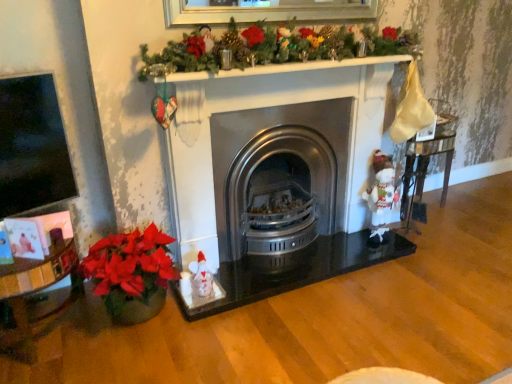
Question: Does point (244, 236) appear closer or farther from the camera than point (402, 178)?

Choices:
 (A) farther
 (B) closer

Answer: (B)

Question: In terms of size, does stainless steel wood burning stove at center appear bigger or smaller than wooden glossy table at right?

Choices:
 (A) small
 (B) big

Answer: (B)

Question: Considering the real-world distances, which object is closest to the white plush santa at right?

Choices:
 (A) stainless steel wood burning stove at center
 (B) wooden glossy table at right

Answer: (B)

Question: Which is nearer to the white plush santa at right?

Choices:
 (A) stainless steel wood burning stove at center
 (B) wooden glossy table at right

Answer: (B)